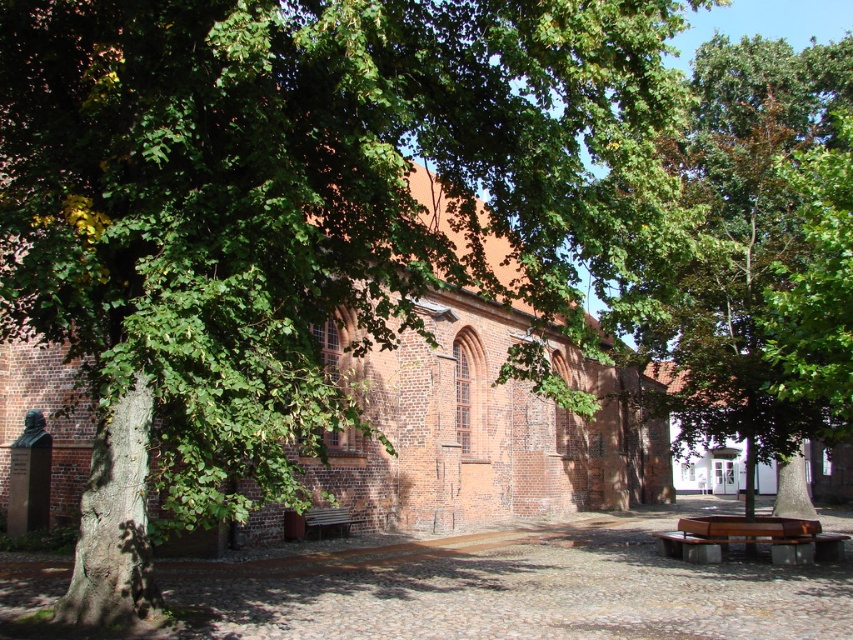
You are standing at the point labeled as point (750, 538) in the image. What object are you currently standing on?

The point (750, 538) corresponds to the brown wooden bench at lower right, so you are standing on the brown wooden bench at lower right.

You are a visitor at this historic site and want to sit on the brown wooden bench at lower right. However, you notice another brown wooden bench at center. Which bench is positioned higher relative to the other?

The brown wooden bench at lower right is located above the brown wooden bench at center, so it is positioned higher.